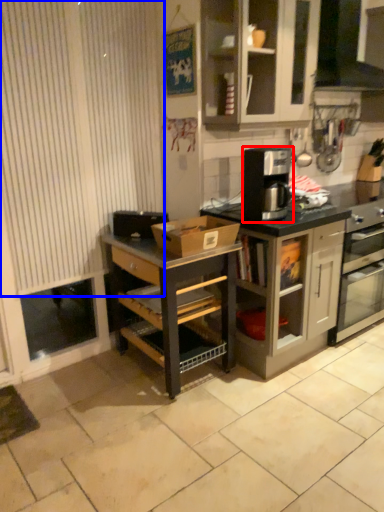
Question: Among these objects, which one is nearest to the camera, kitchen appliance (highlighted by a red box) or curtain (highlighted by a blue box)?

Choices:
 (A) kitchen appliance
 (B) curtain

Answer: (B)